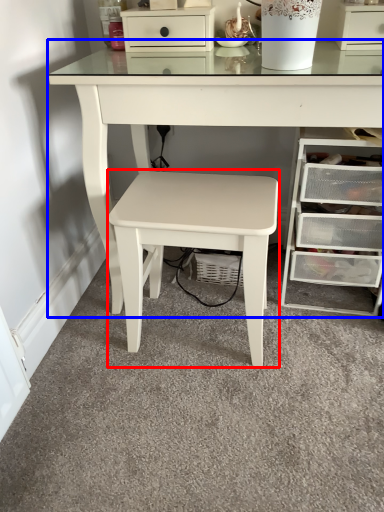
Question: Which of the following is the farthest to the observer, stool (highlighted by a red box) or table (highlighted by a blue box)?

Choices:
 (A) stool
 (B) table

Answer: (A)